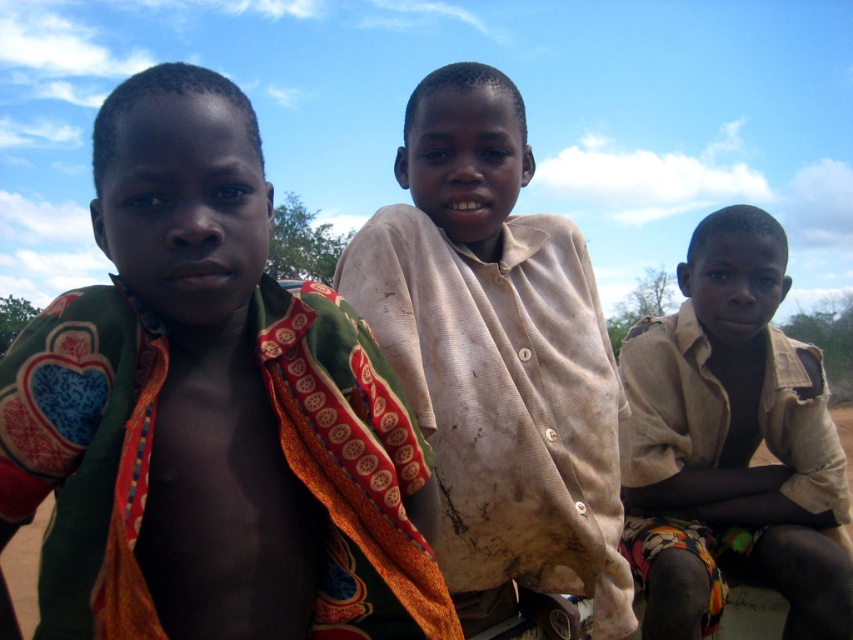
Based on the photo, based on the scene description, can you determine if the light brown cotton shirt at center is covering any part of the brown dirt field at lower center?

The light brown cotton shirt at center is positioned over brown dirt field at lower center, so yes, the shirt is covering part of the brown dirt field at lower center.